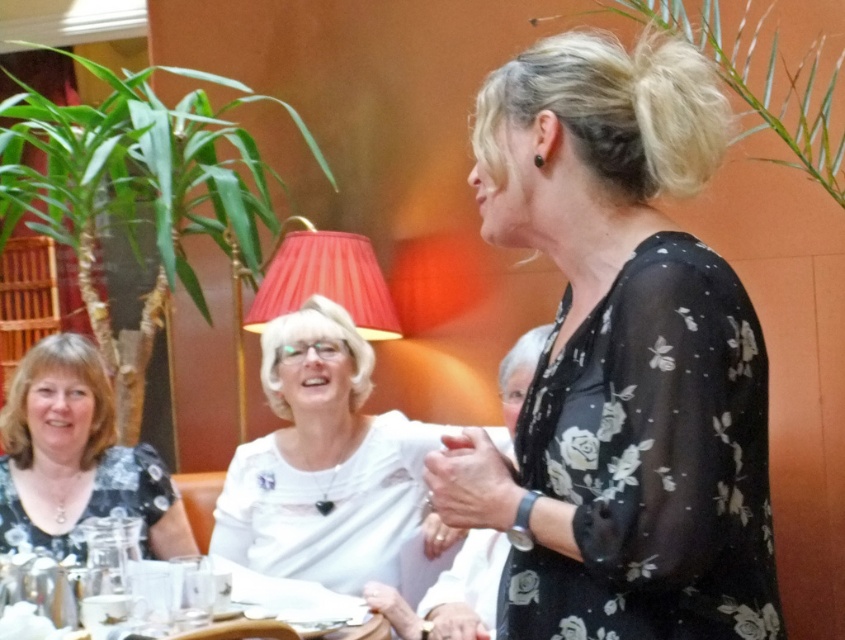
Question: Which point is farther from the camera taking this photo?

Choices:
 (A) (683, 316)
 (B) (107, 408)
 (C) (177, 588)

Answer: (B)

Question: Can you confirm if black floral blouse at center is smaller than white satin blouse at center?

Choices:
 (A) no
 (B) yes

Answer: (B)

Question: Which is nearer to the clear glassware at lower left?

Choices:
 (A) white satin blouse at center
 (B) matte black dress at lower left

Answer: (A)

Question: Estimate the real-world distances between objects in this image. Which object is closer to the black floral blouse at center?

Choices:
 (A) clear glassware at lower left
 (B) white satin blouse at center

Answer: (A)

Question: Is white satin blouse at center to the left of clear glassware at lower left from the viewer's perspective?

Choices:
 (A) no
 (B) yes

Answer: (A)

Question: Does black floral blouse at center come in front of white satin blouse at center?

Choices:
 (A) yes
 (B) no

Answer: (A)